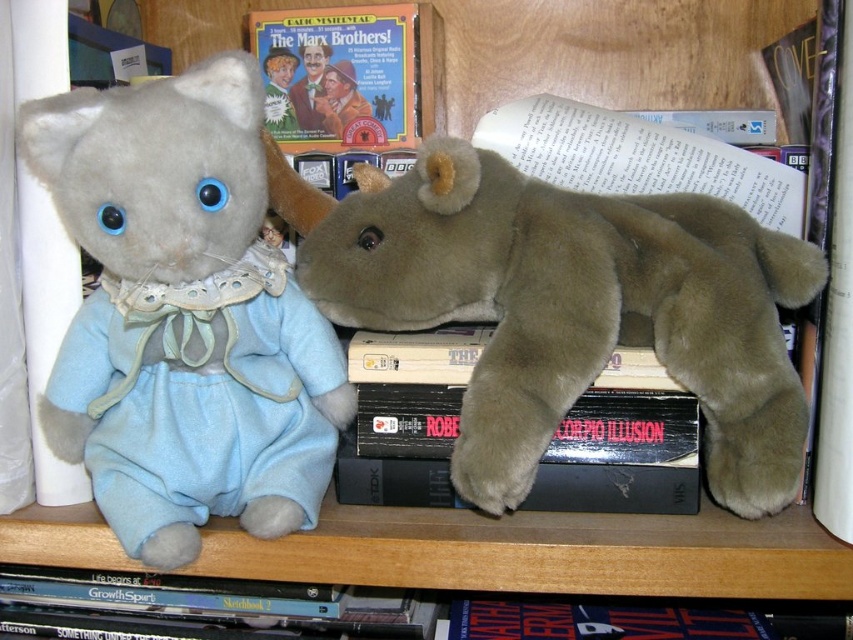
You are organizing a childrens birthday party and need to decide which items to move to make space. If you have to choose between the matte blue plush cat at left and the black matte book at center, which item would you move first to create more space?

The matte blue plush cat at left is larger in size than the black matte book at center, so moving the matte blue plush cat at left first would create more space.

You are organizing a shelf and need to decide whether to place a new small statue between the matte blue plush cat at left and the black matte book at center. Given their sizes, will there be enough space for the statue?

The matte blue plush cat at left is much taller than the black matte book at center. Since the statue is small, there should be enough vertical space between them to place it, but horizontal space depends on their widths which aren